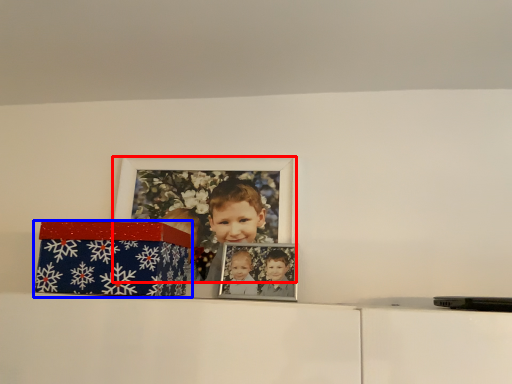
Question: Which point is closer to the camera, picture frame (highlighted by a red box) or box (highlighted by a blue box)?

Choices:
 (A) picture frame
 (B) box

Answer: (B)